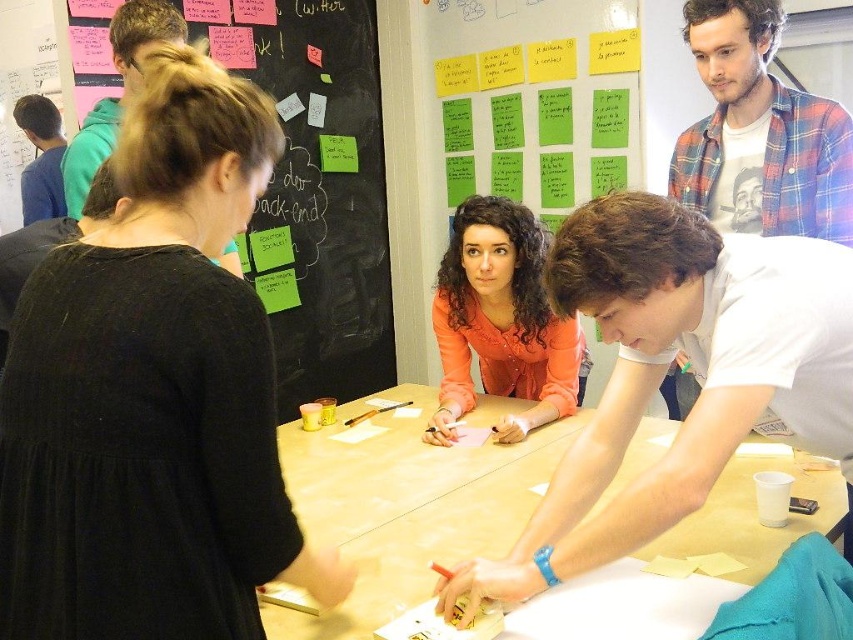
You are standing in the room and want to place a small plant on the light brown wood table at center so that it is visible to the person wearing the plaid flannel shirt at upper right. Is the plant visible from their position?

The light brown wood table at center is below the plaid flannel shirt at upper right, so the plant placed on the table would be visible to the person wearing the plaid flannel shirt at upper right as they are positioned above it.

Consider the image. You are standing at the point labeled point (345, 10) and want to walk to the point labeled point (724, 394). Is the point you want to reach in front of you or behind you?

Since point (724, 394) is in front of point (345, 10), the point you want to reach is in front of you.